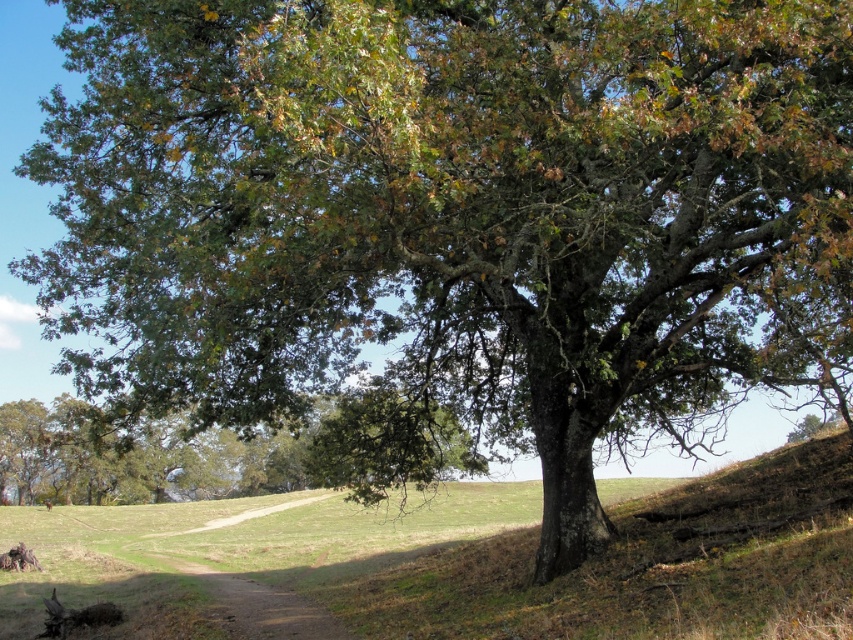
You are standing at the center of the dirt path leading to the tree. Which direction should you walk to reach the green leafy tree at lower left?

The green leafy tree at lower left is located at coordinates point [165,456], so you should walk towards the lower left direction to reach it.

You are planning to place a small garden bench between the green leafy tree at lower left and the brown fur dog at lower left. Which object should the bench be closer to to ensure it fits within the space?

The bench should be closer to the brown fur dog at lower left because the green leafy tree at lower left is wider, so positioning the bench near the narrower object allows for better space utilization.

You are a hiker who wants to take your brown fur dog at lower left for a walk along the dirt path. Since the green leafy tree at lower left is in the way, can you pass around it easily?

The green leafy tree at lower left is larger in size than brown fur dog at lower left, so you can pass around it easily since the tree is bigger and likely has space around it.